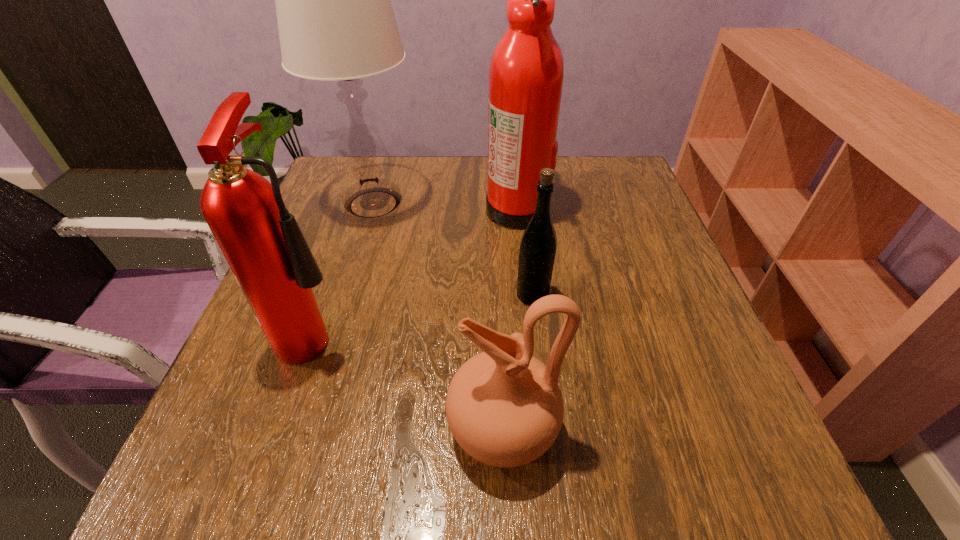
The width and height of the screenshot is (960, 540). What are the coordinates of `free region that satisfies the following two spatial constraints: 1. on the front-facing side of the table lamp; 2. on the back side of the beer bottle` in the screenshot? It's located at (347, 295).

Image resolution: width=960 pixels, height=540 pixels. What are the coordinates of `vacant region that satisfies the following two spatial constraints: 1. on the label side of the taller fire extinguisher; 2. on the left side of the beer bottle` in the screenshot? It's located at (526, 295).

I want to click on free space that satisfies the following two spatial constraints: 1. on the front-facing side of the table lamp; 2. on the left side of the beer bottle, so click(347, 295).

This screenshot has width=960, height=540. Identify the location of free spot that satisfies the following two spatial constraints: 1. on the back side of the beer bottle; 2. on the front-facing side of the table lamp. (522, 204).

Identify the location of free space that satisfies the following two spatial constraints: 1. on the front-facing side of the table lamp; 2. on the right side of the beer bottle. The height and width of the screenshot is (540, 960). (347, 295).

You are a GUI agent. You are given a task and a screenshot of the screen. Output one action in this format:
    pyautogui.click(x=<x>, y=<y>)
    Task: Click on the free location that satisfies the following two spatial constraints: 1. on the back side of the beer bottle; 2. on the front-facing side of the table lamp
    
    Given the screenshot: What is the action you would take?
    pyautogui.click(x=522, y=204)